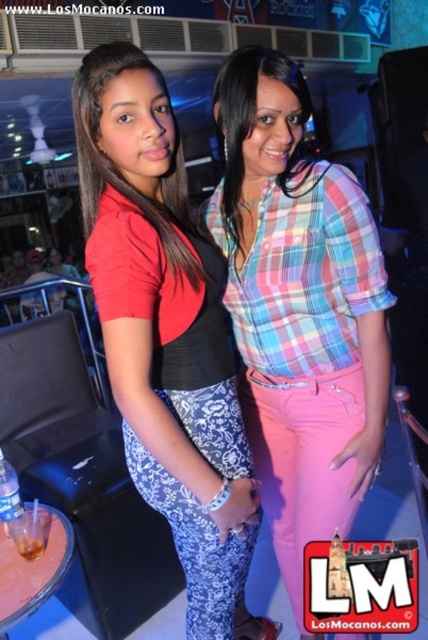
Question: In this image, where is plaid fabric shirt at center located relative to matte black top at center?

Choices:
 (A) left
 (B) right

Answer: (B)

Question: Which of the following is the farthest from the observer?

Choices:
 (A) plaid fabric shirt at center
 (B) matte black top at center

Answer: (A)

Question: Does plaid fabric shirt at center have a lesser width compared to matte black top at center?

Choices:
 (A) no
 (B) yes

Answer: (B)

Question: Observing the image, what is the correct spatial positioning of plaid fabric shirt at center in reference to matte black top at center?

Choices:
 (A) right
 (B) left

Answer: (A)